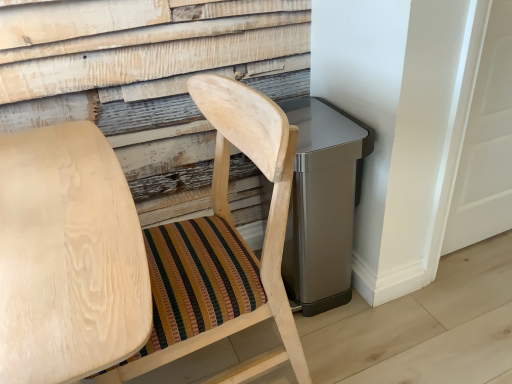
Question: From the image's perspective, is natural wood chair at center, which is the first chair from left to right, below natural wood chair at center, positioned as the 1th chair in right-to-left order?

Choices:
 (A) no
 (B) yes

Answer: (B)

Question: Is natural wood chair at center, which is the first chair from left to right, not near natural wood chair at center, acting as the second chair starting from the left?

Choices:
 (A) no
 (B) yes

Answer: (A)

Question: Considering the relative sizes of natural wood chair at center, which is the first chair from left to right, and natural wood chair at center, positioned as the 1th chair in right-to-left order, in the image provided, is natural wood chair at center, which is the first chair from left to right, shorter than natural wood chair at center, positioned as the 1th chair in right-to-left order,?

Choices:
 (A) yes
 (B) no

Answer: (A)

Question: Considering the relative sizes of natural wood chair at center, which is the first chair from left to right, and natural wood chair at center, acting as the second chair starting from the left, in the image provided, is natural wood chair at center, which is the first chair from left to right, smaller than natural wood chair at center, acting as the second chair starting from the left,?

Choices:
 (A) no
 (B) yes

Answer: (A)

Question: Can you confirm if natural wood chair at center, which is counted as the second chair, starting from the right, is positioned to the right of natural wood chair at center, acting as the second chair starting from the left?

Choices:
 (A) yes
 (B) no

Answer: (B)

Question: Would you say natural wood chair at center, acting as the second chair starting from the left, is part of natural wood chair at center, which is counted as the second chair, starting from the right,'s contents?

Choices:
 (A) yes
 (B) no

Answer: (B)

Question: From a real-world perspective, is natural wood chair at center, positioned as the 1th chair in right-to-left order, located beneath natural wood chair at center, which is the first chair from left to right?

Choices:
 (A) no
 (B) yes

Answer: (A)

Question: From the image's perspective, is natural wood chair at center, positioned as the 1th chair in right-to-left order, located beneath natural wood chair at center, which is counted as the second chair, starting from the right?

Choices:
 (A) no
 (B) yes

Answer: (A)

Question: Can you confirm if natural wood chair at center, acting as the second chair starting from the left, is wider than natural wood chair at center, which is counted as the second chair, starting from the right?

Choices:
 (A) yes
 (B) no

Answer: (B)

Question: Is natural wood chair at center, acting as the second chair starting from the left, surrounding natural wood chair at center, which is counted as the second chair, starting from the right?

Choices:
 (A) no
 (B) yes

Answer: (A)

Question: Does natural wood chair at center, acting as the second chair starting from the left, lie behind natural wood chair at center, which is the first chair from left to right?

Choices:
 (A) yes
 (B) no

Answer: (A)

Question: Does natural wood chair at center, acting as the second chair starting from the left, have a larger size compared to natural wood chair at center, which is the first chair from left to right?

Choices:
 (A) yes
 (B) no

Answer: (B)

Question: Is natural wood chair at center, acting as the second chair starting from the left, in front of or behind natural wood chair at center, which is counted as the second chair, starting from the right, in the image?

Choices:
 (A) behind
 (B) front

Answer: (A)